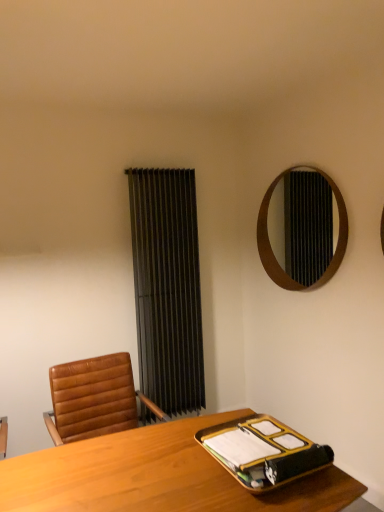
I want to click on light wood desk at center, so click(156, 476).

What do you see at coordinates (263, 452) in the screenshot? The image size is (384, 512). I see `gold metallic binder at lower right` at bounding box center [263, 452].

I want to click on black fabric curtain at center, so click(167, 287).

Considering the positions of objects gold metallic binder at lower right and black fabric curtain at center in the image provided, who is more to the left, gold metallic binder at lower right or black fabric curtain at center?

black fabric curtain at center.

Is there a large distance between gold metallic binder at lower right and black fabric curtain at center?

Indeed, gold metallic binder at lower right is not near black fabric curtain at center.

Between point (285, 450) and point (189, 315), which one is positioned behind?

Point (189, 315)

From the picture: Is gold metallic binder at lower right positioned beyond the bounds of black fabric curtain at center?

Yes, gold metallic binder at lower right is not within black fabric curtain at center.

From the picture: Is black fabric curtain at center positioned beyond the bounds of wooden mirror at upper right?

Yes.

Is black fabric curtain at center turned away from wooden mirror at upper right?

No, wooden mirror at upper right is not at the back of black fabric curtain at center.

I want to click on curtain below the wooden mirror at upper right (from the image's perspective), so click(x=167, y=287).

Is light wood desk at center wider than wooden mirror at upper right?

Indeed, light wood desk at center has a greater width compared to wooden mirror at upper right.

Consider the image. Visually, is light wood desk at center positioned to the left or to the right of wooden mirror at upper right?

In the image, light wood desk at center appears on the left side of wooden mirror at upper right.

Considering the relative sizes of light wood desk at center and wooden mirror at upper right in the image provided, is light wood desk at center smaller than wooden mirror at upper right?

Actually, light wood desk at center might be larger than wooden mirror at upper right.

Based on the photo, is light wood desk at center behind wooden mirror at upper right?

That is False.

Considering the relative sizes of light wood desk at center and gold metallic binder at lower right in the image provided, is light wood desk at center bigger than gold metallic binder at lower right?

Yes, light wood desk at center is bigger than gold metallic binder at lower right.

Does light wood desk at center have a greater height compared to gold metallic binder at lower right?

Yes, light wood desk at center is taller than gold metallic binder at lower right.

Is light wood desk at center with gold metallic binder at lower right?

No, light wood desk at center is not next to gold metallic binder at lower right.

In the scene shown: Is light wood desk at center inside the boundaries of gold metallic binder at lower right, or outside?

light wood desk at center exists outside the volume of gold metallic binder at lower right.

Does point (258, 445) come in front of point (324, 183)?

Yes, it is.

From a real-world perspective, is gold metallic binder at lower right located beneath wooden mirror at upper right?

Yes, from a real-world perspective, gold metallic binder at lower right is beneath wooden mirror at upper right.

Between gold metallic binder at lower right and wooden mirror at upper right, which one has smaller width?

wooden mirror at upper right.

From the image's perspective, which is below, gold metallic binder at lower right or wooden mirror at upper right?

gold metallic binder at lower right, from the image's perspective.

Measure the distance from gold metallic binder at lower right to light wood desk at center.

A distance of 7.27 inches exists between gold metallic binder at lower right and light wood desk at center.

Does gold metallic binder at lower right have a greater height compared to light wood desk at center?

No.

From the image's perspective, is gold metallic binder at lower right above light wood desk at center?

Yes.

Could you tell me if gold metallic binder at lower right is facing light wood desk at center?

No, gold metallic binder at lower right is not facing towards light wood desk at center.

Between black fabric curtain at center and gold metallic binder at lower right, which one appears on the right side from the viewer's perspective?

From the viewer's perspective, gold metallic binder at lower right appears more on the right side.

Considering the positions of point (180, 203) and point (236, 435), is point (180, 203) closer or farther from the camera than point (236, 435)?

Point (180, 203) is farther from the camera than point (236, 435).

Find the location of a particular element. This screenshot has height=512, width=384. binder below the black fabric curtain at center (from the image's perspective) is located at coordinates (263, 452).

The height and width of the screenshot is (512, 384). I want to click on binder below the black fabric curtain at center (from a real-world perspective), so click(263, 452).

What are the coordinates of `mirror on the right side of black fabric curtain at center` in the screenshot? It's located at (303, 228).

Looking at the image, which one is located further to light wood desk at center, wooden mirror at upper right or black fabric curtain at center?

wooden mirror at upper right.

Estimate the real-world distances between objects in this image. Which object is closer to black fabric curtain at center, gold metallic binder at lower right or wooden mirror at upper right?

wooden mirror at upper right is closer to black fabric curtain at center.

Estimate the real-world distances between objects in this image. Which object is closer to light wood desk at center, black fabric curtain at center or wooden mirror at upper right?

black fabric curtain at center is closer to light wood desk at center.

Looking at the image, which one is located further to black fabric curtain at center, light wood desk at center or gold metallic binder at lower right?

gold metallic binder at lower right lies further to black fabric curtain at center than the other object.

Estimate the real-world distances between objects in this image. Which object is further from wooden mirror at upper right, black fabric curtain at center or light wood desk at center?

light wood desk at center.

Based on the photo, when comparing their distances from wooden mirror at upper right, does light wood desk at center or gold metallic binder at lower right seem closer?

gold metallic binder at lower right.

Estimate the real-world distances between objects in this image. Which object is closer to light wood desk at center, wooden mirror at upper right or gold metallic binder at lower right?

Among the two, gold metallic binder at lower right is located nearer to light wood desk at center.

Consider the image. From the image, which object appears to be farther from black fabric curtain at center, gold metallic binder at lower right or light wood desk at center?

Based on the image, gold metallic binder at lower right appears to be further to black fabric curtain at center.

Locate an element on the screen. Image resolution: width=384 pixels, height=512 pixels. mirror located between gold metallic binder at lower right and black fabric curtain at center in the depth direction is located at coordinates (303, 228).

This screenshot has width=384, height=512. Identify the location of mirror between light wood desk at center and black fabric curtain at center along the z-axis. (303, 228).

The width and height of the screenshot is (384, 512). I want to click on binder between light wood desk at center and black fabric curtain at center along the z-axis, so click(x=263, y=452).

Locate an element on the screen. This screenshot has height=512, width=384. binder located between light wood desk at center and wooden mirror at upper right in the depth direction is located at coordinates (263, 452).